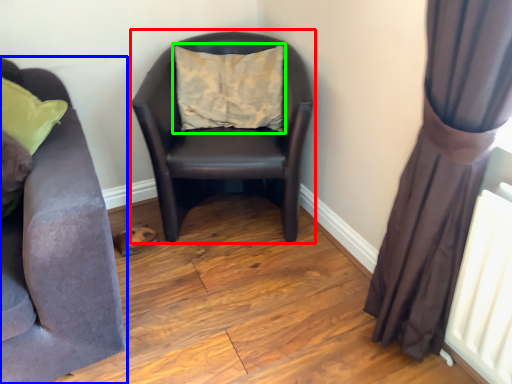
Question: Which object is positioned closest to rocking chair (highlighted by a red box)? Select from studio couch (highlighted by a blue box) and pillow (highlighted by a green box).

Choices:
 (A) studio couch
 (B) pillow

Answer: (B)